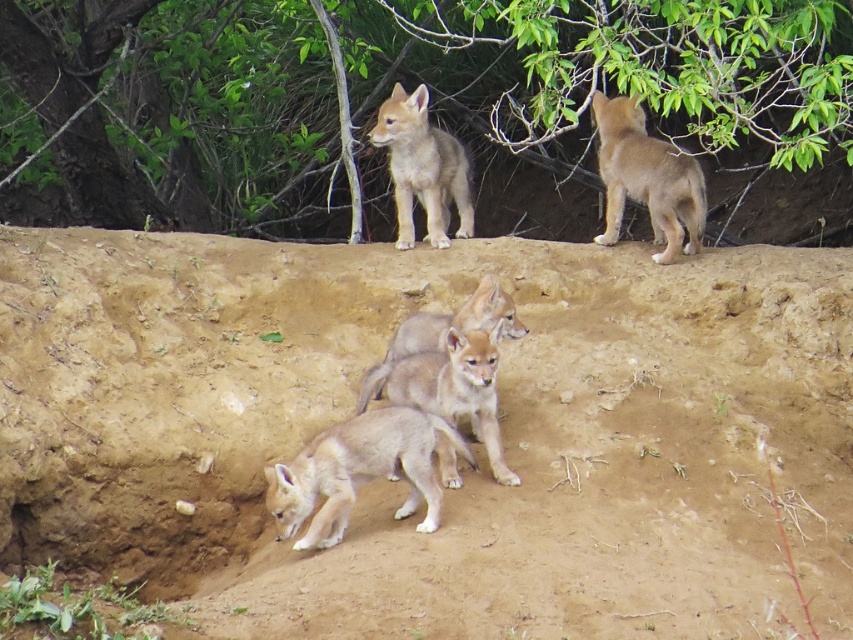
Is green leafy tree at upper center bigger than fuzzy brown coyote at upper center?

Correct, green leafy tree at upper center is larger in size than fuzzy brown coyote at upper center.

Is point (657, 4) closer to viewer compared to point (412, 145)?

Yes, point (657, 4) is closer to viewer.

Who is more distant from viewer, (178, 182) or (379, 134)?

The point (178, 182) is more distant.

You are a GUI agent. You are given a task and a screenshot of the screen. Output one action in this format:
    pyautogui.click(x=<x>, y=<y>)
    Task: Click on the green leafy tree at upper center
    The width and height of the screenshot is (853, 640).
    Given the screenshot: What is the action you would take?
    pyautogui.click(x=409, y=84)

Does fuzzy brown coyote at upper right have a lesser height compared to fuzzy brown coyote at upper center?

Incorrect, fuzzy brown coyote at upper right's height does not fall short of fuzzy brown coyote at upper center's.

Is point (641, 163) in front of point (469, 236)?

Yes.

You are a GUI agent. You are given a task and a screenshot of the screen. Output one action in this format:
    pyautogui.click(x=<x>, y=<y>)
    Task: Click on the fuzzy brown coyote at upper right
    Image resolution: width=853 pixels, height=640 pixels.
    Given the screenshot: What is the action you would take?
    pyautogui.click(x=646, y=177)

The image size is (853, 640). What do you see at coordinates (463, 468) in the screenshot?
I see `brown sandy soil at center` at bounding box center [463, 468].

Can you confirm if brown sandy soil at center is bigger than green leafy tree at upper center?

Yes, brown sandy soil at center is bigger than green leafy tree at upper center.

Which is in front, point (634, 552) or point (494, 1)?

Point (634, 552) is in front.

Locate an element on the screen. Image resolution: width=853 pixels, height=640 pixels. brown sandy soil at center is located at coordinates (463, 468).